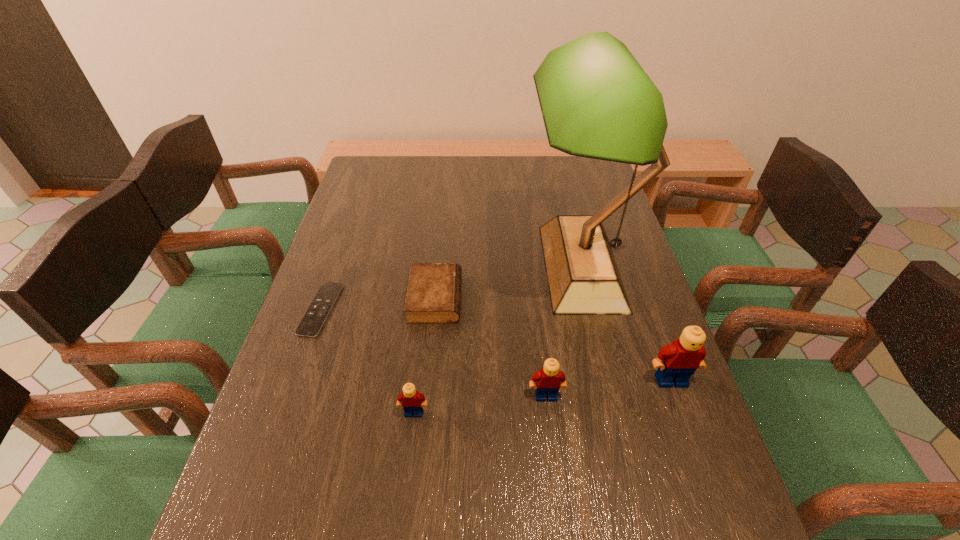
Locate an element on the screen. This screenshot has height=540, width=960. table lamp situated at the right edge is located at coordinates (597, 102).

Where is `free location at the far edge of the desktop`? This screenshot has height=540, width=960. free location at the far edge of the desktop is located at coordinates (416, 187).

In the image, there is a desktop. At what (x,y) coordinates should I click in order to perform the action: click on vacant space at the left edge. Please return your answer as a coordinate pair (x, y). This screenshot has width=960, height=540. Looking at the image, I should click on (336, 353).

The width and height of the screenshot is (960, 540). Identify the location of vacant position at the right edge of the desktop. (620, 250).

You are a GUI agent. You are given a task and a screenshot of the screen. Output one action in this format:
    pyautogui.click(x=<x>, y=<y>)
    Task: Click on the vacant point at the far left corner
    Image resolution: width=960 pixels, height=540 pixels.
    Given the screenshot: What is the action you would take?
    pyautogui.click(x=363, y=186)

The height and width of the screenshot is (540, 960). Find the location of `vacant space at the near left corner`. vacant space at the near left corner is located at coordinates (324, 453).

At what (x,y) coordinates should I click in order to perform the action: click on free space at the far right corner of the desktop. Please return your answer as a coordinate pair (x, y). Looking at the image, I should click on (586, 179).

The width and height of the screenshot is (960, 540). Identify the location of vacant space in between the fourth tallest object and the second Lego from left to right. (480, 404).

In order to click on vacant space that's between the remote control and the farthest Lego in this screenshot , I will do `click(496, 345)`.

Find the location of a particular element. The height and width of the screenshot is (540, 960). free space between the tallest Lego and the shortest object is located at coordinates (496, 345).